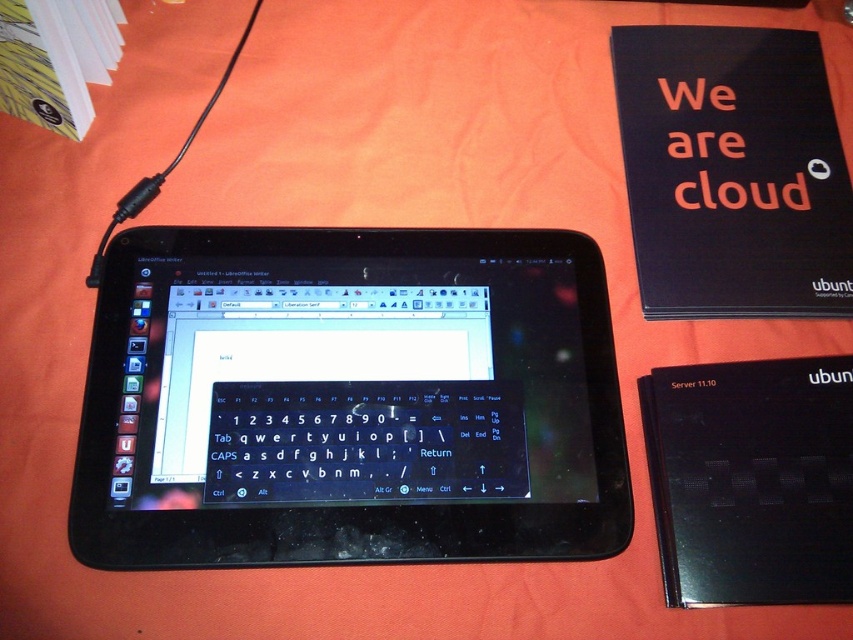
What is located at the point marked by the coordinates (349, 400) in the image?

The point marked by the coordinates (349, 400) is located at the center of the black plastic tablet.

You are setting up a workspace and need to place both the black plastic tablet at center and the black matte tablet at center on a shelf. According to the image, which one should you place first to ensure they are arranged in the correct order as shown?

The black plastic tablet at center should be placed first since it is above the black matte tablet at center in the image, so placing it higher up on the shelf would replicate the arrangement.